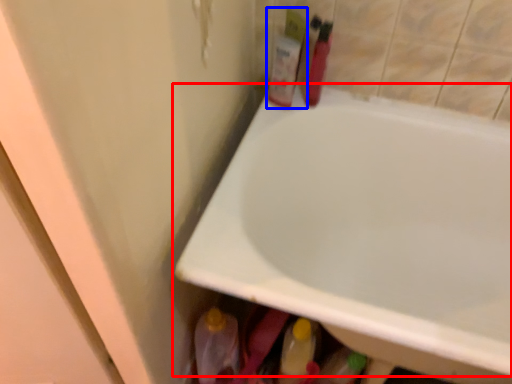
Question: Which of the following is the closest to the observer, bathtub (highlighted by a red box) or toiletry (highlighted by a blue box)?

Choices:
 (A) bathtub
 (B) toiletry

Answer: (A)